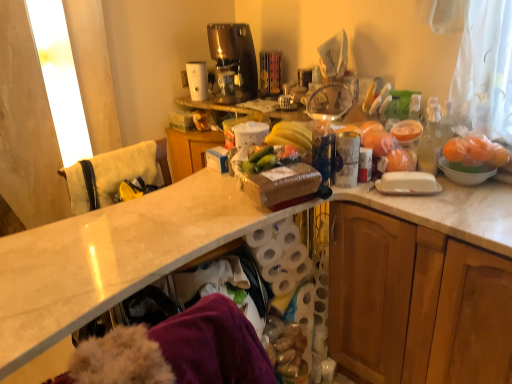
Question: Does green matte cucumber at center contain wooden cabinet at right?

Choices:
 (A) no
 (B) yes

Answer: (A)

Question: Is green matte cucumber at center thinner than wooden cabinet at right?

Choices:
 (A) no
 (B) yes

Answer: (B)

Question: Considering the relative sizes of green matte cucumber at center and wooden cabinet at right in the image provided, is green matte cucumber at center bigger than wooden cabinet at right?

Choices:
 (A) no
 (B) yes

Answer: (A)

Question: Does green matte cucumber at center come in front of wooden cabinet at right?

Choices:
 (A) no
 (B) yes

Answer: (A)

Question: From the image's perspective, is green matte cucumber at center located beneath wooden cabinet at right?

Choices:
 (A) no
 (B) yes

Answer: (A)

Question: Considering the positions of green matte cucumber at center and white towel at left in the image, is green matte cucumber at center bigger or smaller than white towel at left?

Choices:
 (A) small
 (B) big

Answer: (A)

Question: Is green matte cucumber at center in front of or behind white towel at left in the image?

Choices:
 (A) front
 (B) behind

Answer: (A)

Question: Is point (291, 150) positioned closer to the camera than point (160, 140)?

Choices:
 (A) closer
 (B) farther

Answer: (A)

Question: Considering the relative positions of green matte cucumber at center and white towel at left in the image provided, is green matte cucumber at center to the left or to the right of white towel at left?

Choices:
 (A) left
 (B) right

Answer: (B)

Question: Does point (143, 281) appear closer or farther from the camera than point (454, 344)?

Choices:
 (A) closer
 (B) farther

Answer: (A)

Question: Considering the positions of white marble countertop at center and wooden cabinet at right in the image, is white marble countertop at center wider or thinner than wooden cabinet at right?

Choices:
 (A) thin
 (B) wide

Answer: (A)

Question: From a real-world perspective, is white marble countertop at center positioned above or below wooden cabinet at right?

Choices:
 (A) below
 (B) above

Answer: (B)

Question: From the image's perspective, is white marble countertop at center located above or below wooden cabinet at right?

Choices:
 (A) above
 (B) below

Answer: (A)

Question: In the image, is orange matte fruit at right on the left side or the right side of white glossy mixing bowl at right?

Choices:
 (A) left
 (B) right

Answer: (B)

Question: In the image, is orange matte fruit at right positioned in front of or behind white glossy mixing bowl at right?

Choices:
 (A) front
 (B) behind

Answer: (A)